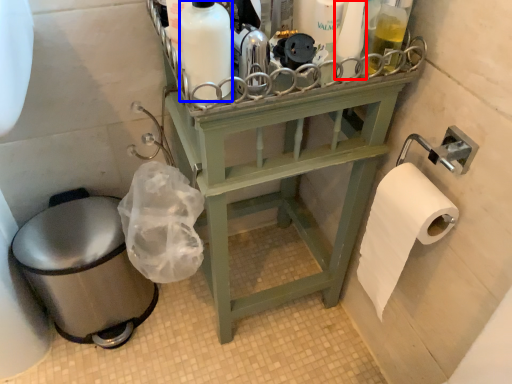
Question: Which object appears closest to the camera in this image, toiletry (highlighted by a red box) or cleaning product (highlighted by a blue box)?

Choices:
 (A) toiletry
 (B) cleaning product

Answer: (B)